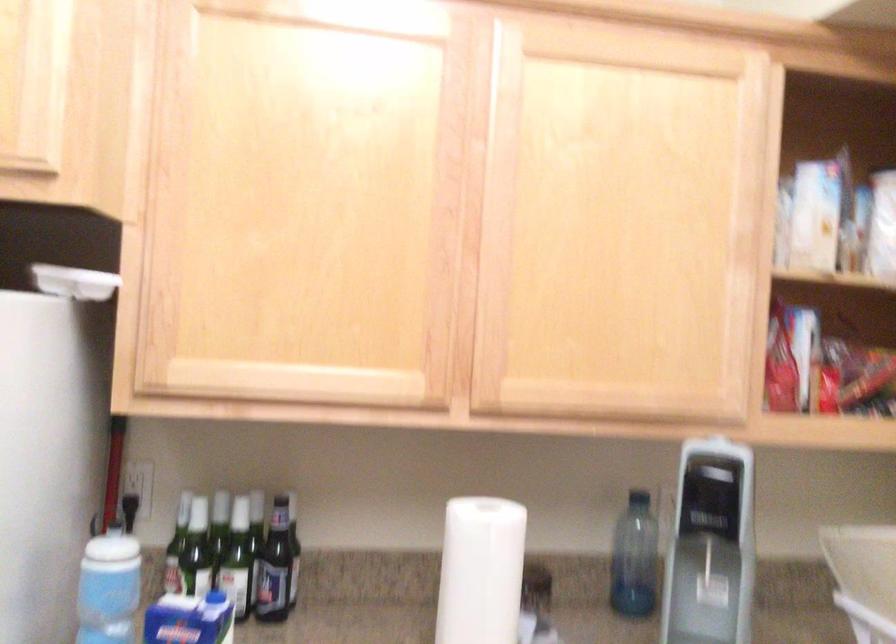
Find where to lift the clear plastic bottle. Please return your answer as a coordinate pair (x, y).

(634, 559)